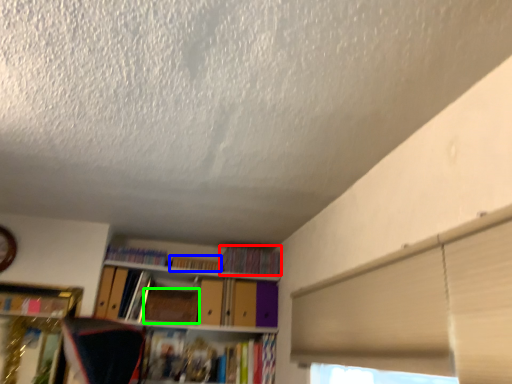
Question: Based on their relative distances, which object is nearer to book (highlighted by a red box)? Choose from book (highlighted by a blue box) and paperback book (highlighted by a green box).

Choices:
 (A) book
 (B) paperback book

Answer: (A)